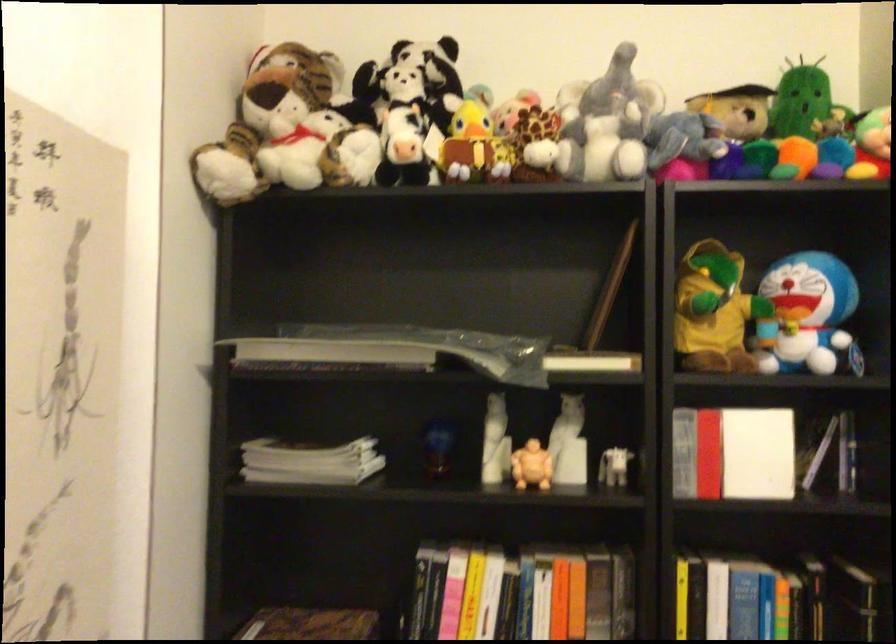
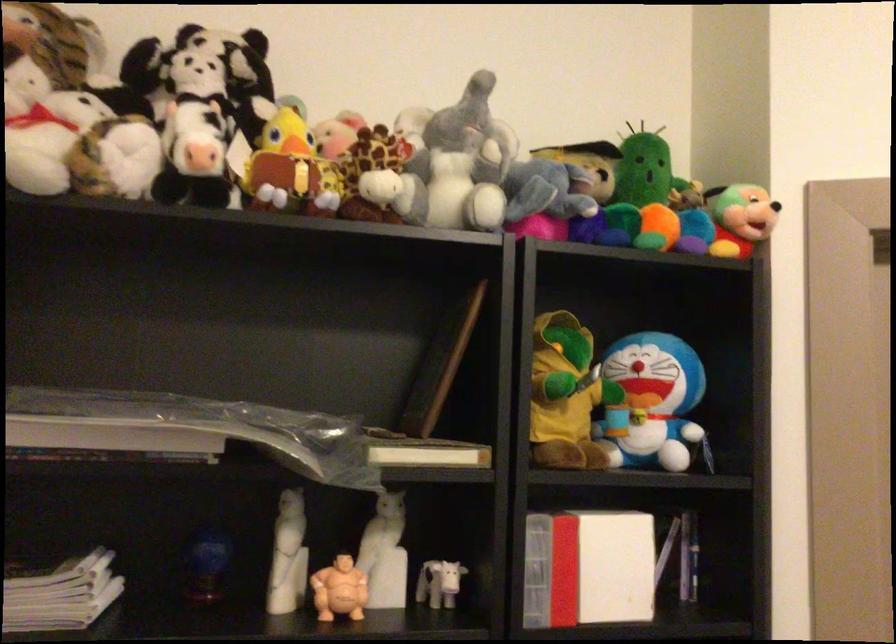
Find the pixel in the second image that matches [492,442] in the first image.

(288, 556)